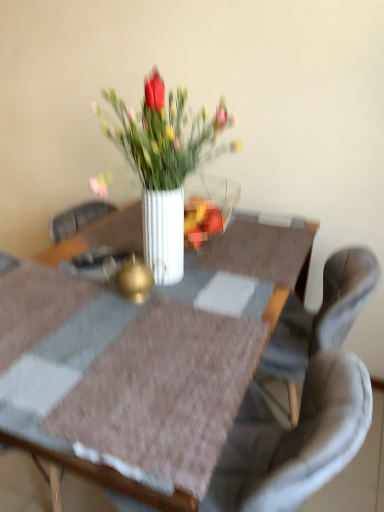
Find the location of `empty space that is ontop of gray fabric chair at center (from a real-world perspective)`. empty space that is ontop of gray fabric chair at center (from a real-world perspective) is located at coordinates (197, 350).